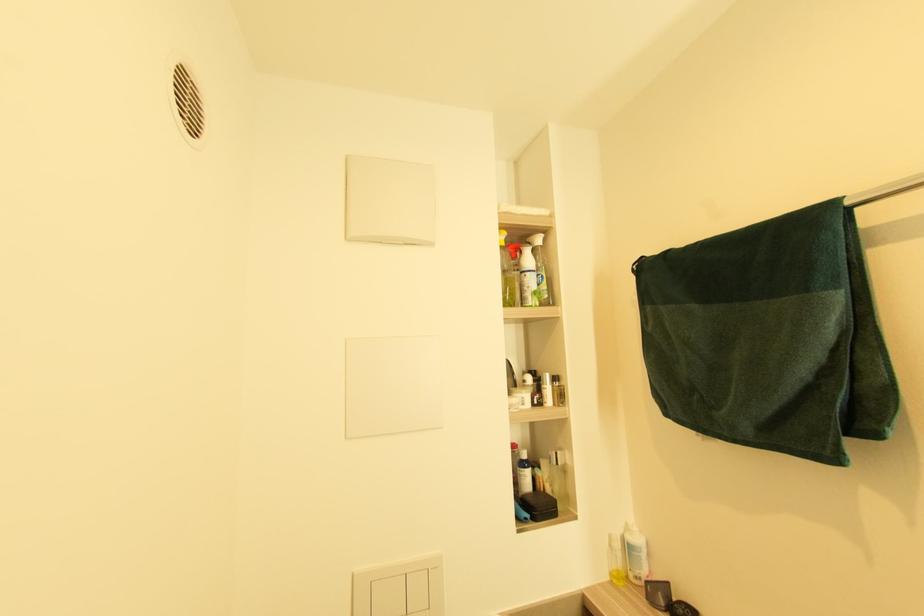
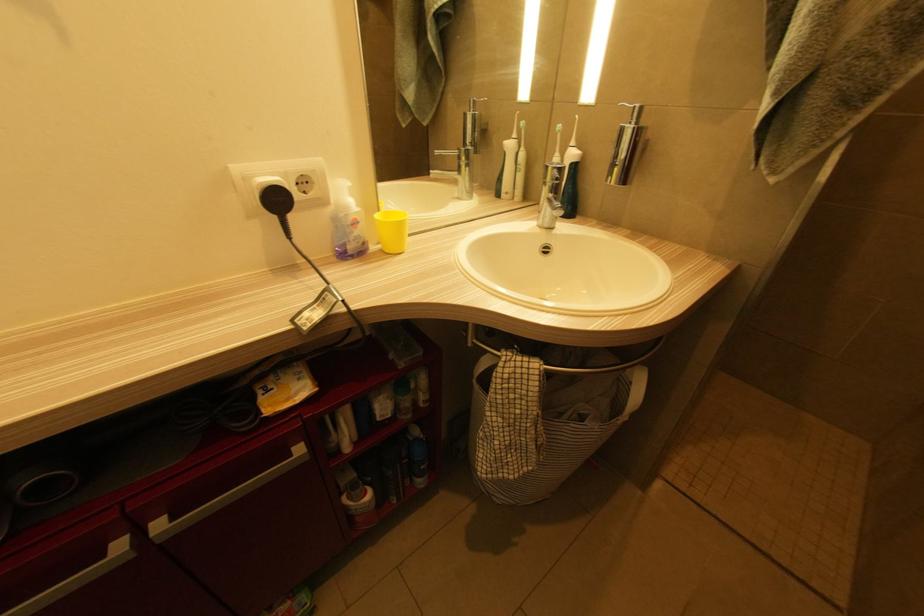
How did the camera likely rotate?

The rotation direction of the camera is right-down.